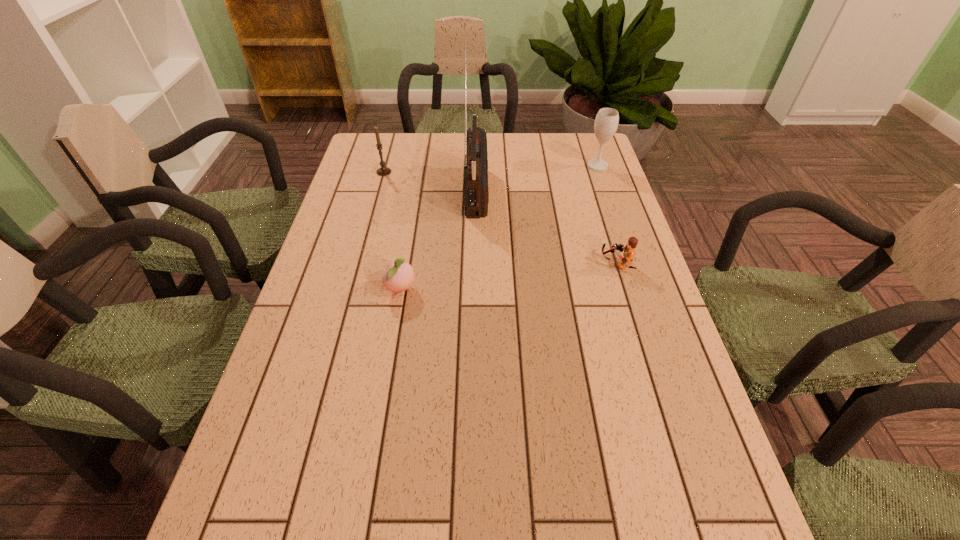
Identify the location of radio receiver. This screenshot has width=960, height=540. (476, 194).

You are a GUI agent. You are given a task and a screenshot of the screen. Output one action in this format:
    pyautogui.click(x=<x>, y=<y>)
    Task: Click on the tallest object
    The height and width of the screenshot is (540, 960).
    Given the screenshot: What is the action you would take?
    pyautogui.click(x=476, y=194)

The width and height of the screenshot is (960, 540). I want to click on wineglass, so click(606, 122).

You are a GUI agent. You are given a task and a screenshot of the screen. Output one action in this format:
    pyautogui.click(x=<x>, y=<y>)
    Task: Click on the candle
    Image resolution: width=960 pixels, height=540 pixels.
    Given the screenshot: What is the action you would take?
    pyautogui.click(x=383, y=171)

In order to click on the leftmost object in this screenshot , I will do [383, 171].

Locate an element on the screen. This screenshot has height=540, width=960. the second nearest object is located at coordinates (629, 250).

Where is `the nearest object`? This screenshot has height=540, width=960. the nearest object is located at coordinates (399, 275).

You are a GUI agent. You are given a task and a screenshot of the screen. Output one action in this format:
    pyautogui.click(x=<x>, y=<y>)
    Task: Click on the fourth object from right to left
    
    Given the screenshot: What is the action you would take?
    pyautogui.click(x=399, y=275)

Where is `vacant position located on the front-facing side of the third object from left to right`? The image size is (960, 540). vacant position located on the front-facing side of the third object from left to right is located at coordinates (536, 188).

Where is `vacant space situated 0.250m on the left of the wineglass`? vacant space situated 0.250m on the left of the wineglass is located at coordinates (512, 166).